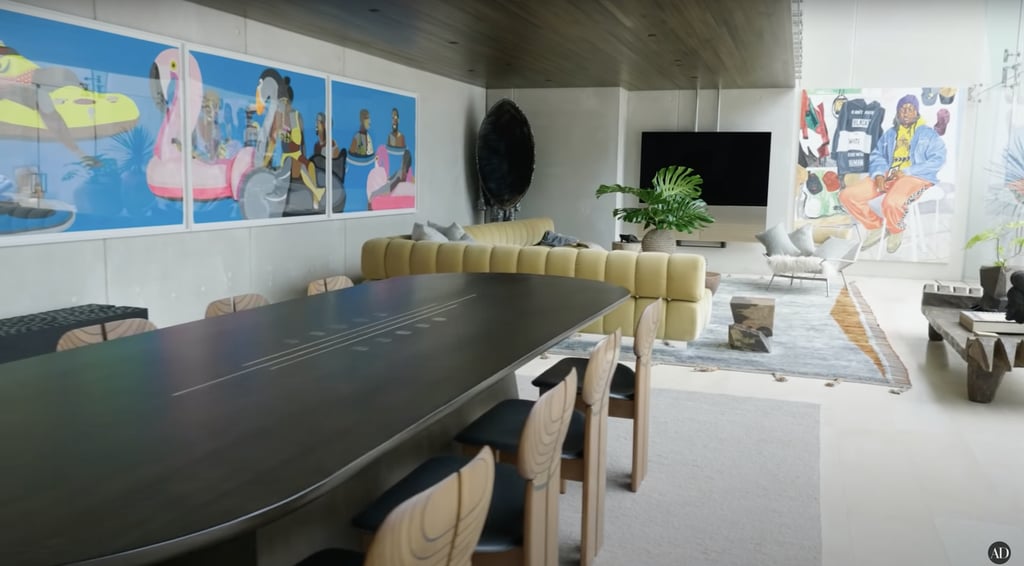
What are the coordinates of `large book` in the screenshot? It's located at (987, 325).